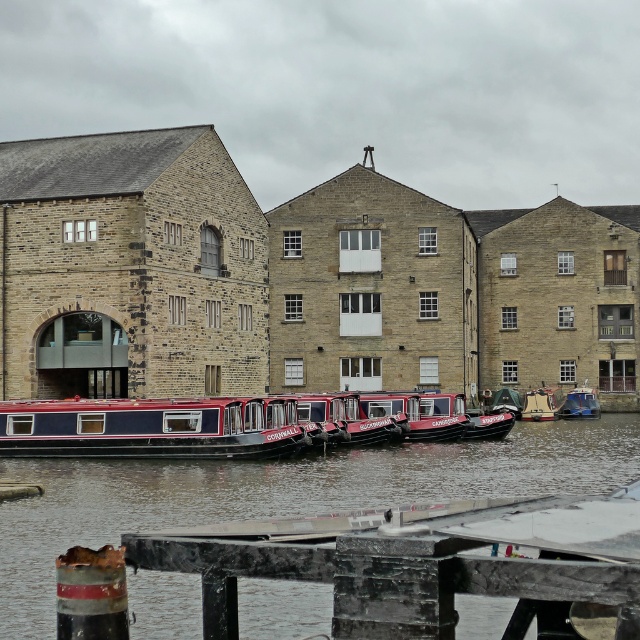
Question: Which of the following is the farthest from the observer?

Choices:
 (A) blue polished wood barge at lower left
 (B) smooth dark blue water at center

Answer: (A)

Question: Estimate the real-world distances between objects in this image. Which object is farther from the metallic blue boat at center?

Choices:
 (A) blue polished wood barge at lower left
 (B) smooth dark blue water at center

Answer: (A)

Question: Is blue polished wood barge at lower left bigger than metallic blue boat at center?

Choices:
 (A) no
 (B) yes

Answer: (B)

Question: Is smooth dark blue water at center bigger than blue polished wood barge at lower left?

Choices:
 (A) yes
 (B) no

Answer: (A)

Question: Can you confirm if blue polished wood barge at lower left is positioned below metallic blue boat at center?

Choices:
 (A) yes
 (B) no

Answer: (B)

Question: Which object is closer to the camera taking this photo?

Choices:
 (A) smooth dark blue water at center
 (B) metallic blue boat at center

Answer: (A)